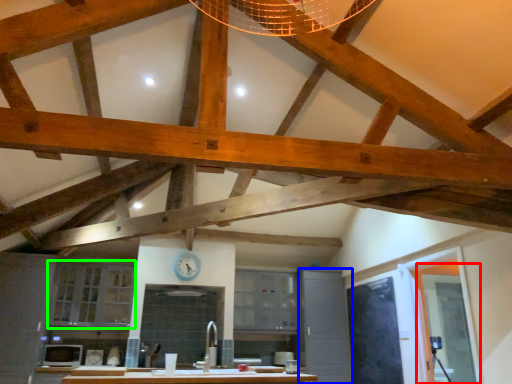
Question: Which is farther away from glass door (highlighted by a red box)? cabinetry (highlighted by a blue box) or cabinetry (highlighted by a green box)?

Choices:
 (A) cabinetry
 (B) cabinetry

Answer: (B)